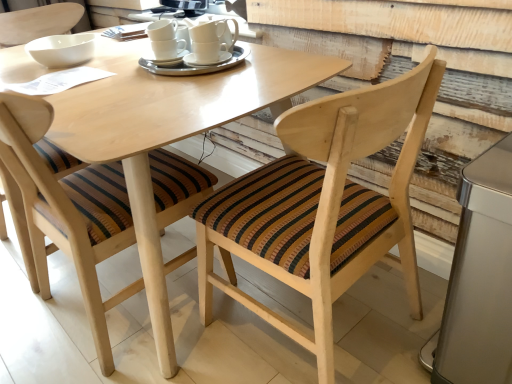
Question: From the image's perspective, relative to white ceramic cup at center, is silver metallic trash can at lower right above or below?

Choices:
 (A) below
 (B) above

Answer: (A)

Question: Is silver metallic trash can at lower right in front of or behind white ceramic cup at center in the image?

Choices:
 (A) front
 (B) behind

Answer: (A)

Question: Estimate the real-world distances between objects in this image. Which object is farther from the white ceramic cups at center, positioned as the 1th tableware in right-to-left order?

Choices:
 (A) wooden chair with striped cushion at center, the 2th chair viewed from the left
 (B) wooden chair with striped cushion at center, which appears as the first chair when viewed from the left
 (C) white ceramic cup at center
 (D) silver metallic trash can at lower right
 (E) white ceramic saucer at center

Answer: (D)

Question: Which object is positioned closest to the wooden chair with striped cushion at center, which appears as the first chair when viewed from the left?

Choices:
 (A) white ceramic saucer at center
 (B) silver metallic trash can at lower right
 (C) wooden chair with striped cushion at center, which is the first chair from right to left
 (D) white ceramic cups at center, acting as the first tableware starting from the left
 (E) white ceramic cups at center, which ranks as the 2th tableware in left-to-right order

Answer: (C)